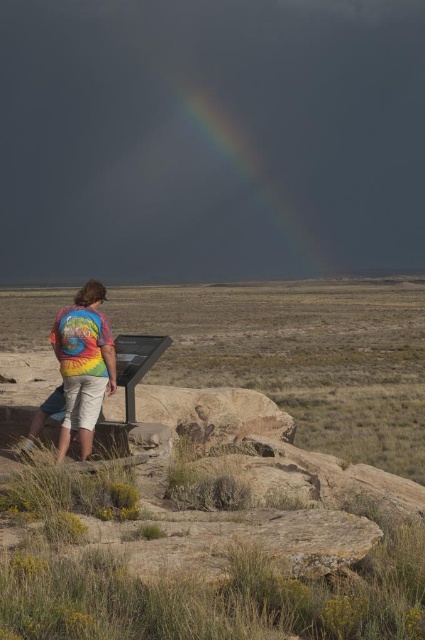
Between rainbow at upper center and tie-dye fabric shirt at center, which one has more height?

With more height is rainbow at upper center.

Does rainbow at upper center have a greater width compared to tie-dye fabric shirt at center?

Indeed, rainbow at upper center has a greater width compared to tie-dye fabric shirt at center.

Is point (249, 164) less distant than point (84, 289)?

That is False.

Identify the location of rainbow at upper center. This screenshot has width=425, height=640. (255, 172).

Does green grass at center come behind tie-dye fabric shirt at center?

No, green grass at center is in front of tie-dye fabric shirt at center.

How much distance is there between green grass at center and tie-dye fabric shirt at center?

green grass at center and tie-dye fabric shirt at center are 8.34 feet apart from each other.

Does point (399, 608) lie behind point (79, 428)?

No, it is not.

You are a GUI agent. You are given a task and a screenshot of the screen. Output one action in this format:
    pyautogui.click(x=<x>, y=<y>)
    Task: Click on the green grass at center
    
    Given the screenshot: What is the action you would take?
    point(215,540)

Is green grass at center smaller than rainbow at upper center?

Yes.

Is green grass at center thinner than rainbow at upper center?

Yes, green grass at center is thinner than rainbow at upper center.

Which is behind, point (51, 374) or point (200, 100)?

Point (200, 100)

Locate an element on the screen. The image size is (425, 640). green grass at center is located at coordinates (215, 540).